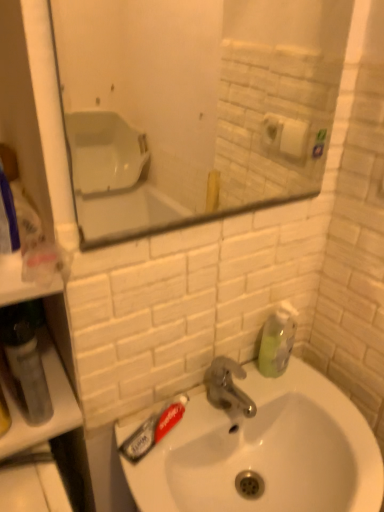
Question: Considering the relative positions of translucent plastic toothpaste at sink left and matte glass mirror at upper center in the image provided, is translucent plastic toothpaste at sink left to the right of matte glass mirror at upper center from the viewer's perspective?

Choices:
 (A) yes
 (B) no

Answer: (B)

Question: From a real-world perspective, does translucent plastic toothpaste at sink left sit lower than matte glass mirror at upper center?

Choices:
 (A) no
 (B) yes

Answer: (B)

Question: Does translucent plastic toothpaste at sink left lie in front of matte glass mirror at upper center?

Choices:
 (A) no
 (B) yes

Answer: (A)

Question: Would you say translucent plastic toothpaste at sink left contains matte glass mirror at upper center?

Choices:
 (A) yes
 (B) no

Answer: (B)

Question: From the image's perspective, is translucent plastic toothpaste at sink left over matte glass mirror at upper center?

Choices:
 (A) yes
 (B) no

Answer: (B)

Question: Does translucent plastic toothpaste at sink left have a greater height compared to matte glass mirror at upper center?

Choices:
 (A) yes
 (B) no

Answer: (B)

Question: Considering the relative sizes of white glossy sink at center and translucent plastic mouthwash at left in the image provided, is white glossy sink at center smaller than translucent plastic mouthwash at left?

Choices:
 (A) yes
 (B) no

Answer: (B)

Question: Is white glossy sink at center taller than translucent plastic mouthwash at left?

Choices:
 (A) no
 (B) yes

Answer: (A)

Question: Does white glossy sink at center come in front of translucent plastic mouthwash at left?

Choices:
 (A) yes
 (B) no

Answer: (A)

Question: Is white glossy sink at center next to translucent plastic mouthwash at left?

Choices:
 (A) yes
 (B) no

Answer: (B)

Question: From a real-world perspective, is white glossy sink at center positioned over translucent plastic mouthwash at left based on gravity?

Choices:
 (A) yes
 (B) no

Answer: (B)

Question: Does white glossy sink at center have a larger size compared to translucent plastic mouthwash at left?

Choices:
 (A) no
 (B) yes

Answer: (B)

Question: Is green translucent soap dispenser at right not close to matte glass mirror at upper center?

Choices:
 (A) yes
 (B) no

Answer: (A)